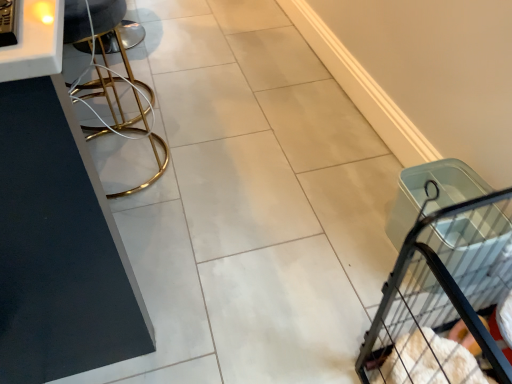
At what (x,y) coordinates should I click in order to perform the action: click on gold metallic bar stool at left. Please return your answer as a coordinate pair (x, y). Image resolution: width=512 pixels, height=384 pixels. Looking at the image, I should click on (113, 78).

Describe the element at coordinates (113, 78) in the screenshot. The width and height of the screenshot is (512, 384). I see `gold metallic bar stool at left` at that location.

Image resolution: width=512 pixels, height=384 pixels. I want to click on gold metallic bar stool at left, so click(x=113, y=78).